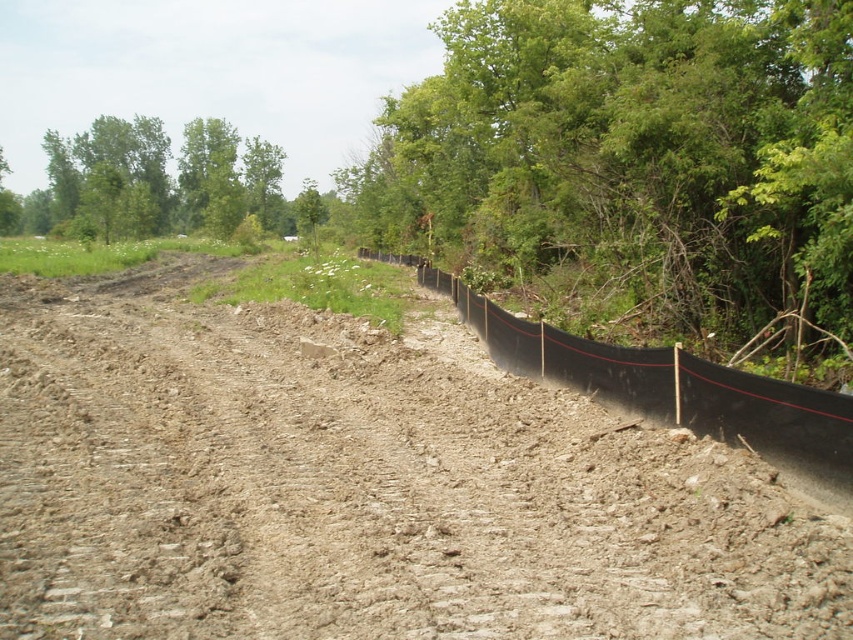
How far apart are brown soil at center and black plastic fence at right?

14.61 feet

Is brown soil at center positioned before black plastic fence at right?

Yes.

Between point (138, 392) and point (657, 387), which one is positioned in front?

Point (657, 387)

This screenshot has height=640, width=853. I want to click on brown soil at center, so click(x=363, y=486).

Does green leafy tree at right have a lesser height compared to black plastic fence at right?

No, green leafy tree at right is not shorter than black plastic fence at right.

Is green leafy tree at right positioned behind black plastic fence at right?

That is True.

Where is `green leafy tree at right`? green leafy tree at right is located at coordinates (631, 157).

Which of these two, brown soil at center or green leafy tree at right, stands taller?

green leafy tree at right is taller.

Measure the distance between brown soil at center and camera.

brown soil at center is 4.37 meters away from camera.

Is point (334, 465) positioned in front of point (625, 260)?

Yes, it is.

You are a GUI agent. You are given a task and a screenshot of the screen. Output one action in this format:
    pyautogui.click(x=<x>, y=<y>)
    Task: Click on the brown soil at center
    
    Given the screenshot: What is the action you would take?
    pyautogui.click(x=363, y=486)